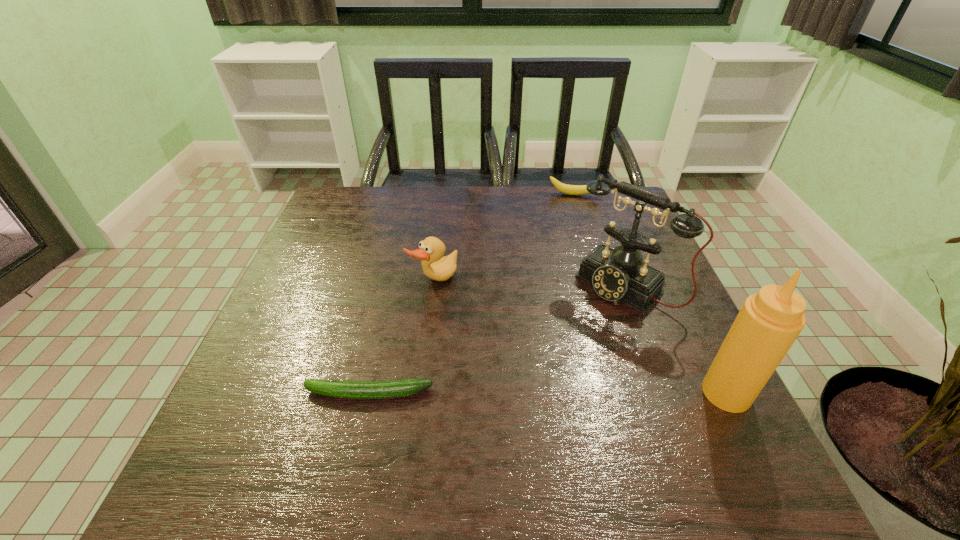
Find the location of a particular element. Image resolution: width=960 pixels, height=540 pixels. zucchini that is at the near edge is located at coordinates (397, 388).

Where is `condiment that is at the near edge`? This screenshot has width=960, height=540. condiment that is at the near edge is located at coordinates (769, 322).

Where is `object present at the left edge`? This screenshot has height=540, width=960. object present at the left edge is located at coordinates (397, 388).

What are the coordinates of `condiment located in the right edge section of the desktop` in the screenshot? It's located at (769, 322).

Locate an element on the screen. banana located in the right edge section of the desktop is located at coordinates (564, 188).

The width and height of the screenshot is (960, 540). In order to click on telephone that is at the right edge in this screenshot , I will do `click(616, 274)`.

You are a GUI agent. You are given a task and a screenshot of the screen. Output one action in this format:
    pyautogui.click(x=<x>, y=<y>)
    Task: Click on the object that is at the near left corner
    The width and height of the screenshot is (960, 540).
    Given the screenshot: What is the action you would take?
    pyautogui.click(x=397, y=388)

Identify the location of object at the far right corner. The height and width of the screenshot is (540, 960). (564, 188).

The height and width of the screenshot is (540, 960). Identify the location of object that is at the near right corner. (769, 322).

In the image, there is a desktop. At what (x,y) coordinates should I click in order to perform the action: click on free space at the far edge. Please return your answer as a coordinate pair (x, y). This screenshot has height=540, width=960. Looking at the image, I should click on (456, 230).